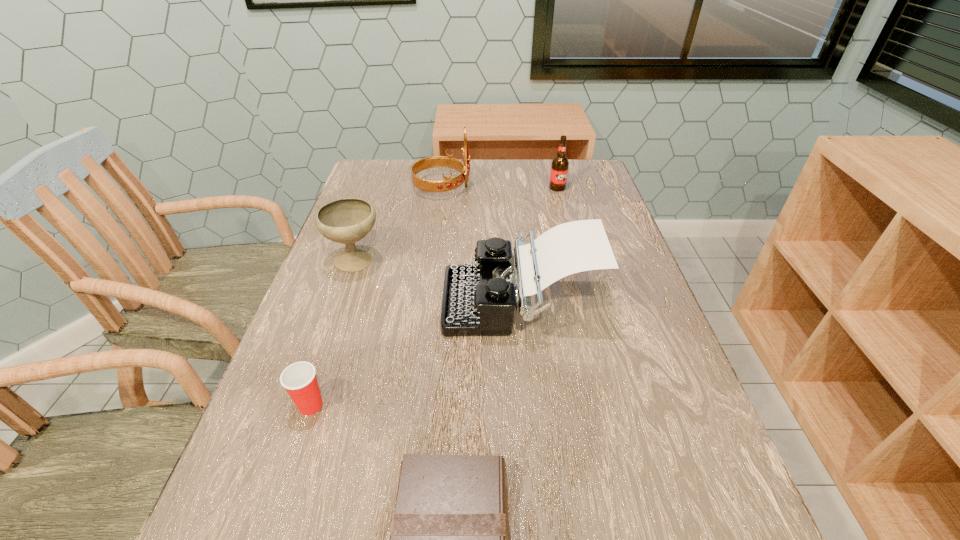
This screenshot has height=540, width=960. In the image, there is a desktop. In order to click on vacant region at the far edge in this screenshot , I will do `click(552, 197)`.

This screenshot has width=960, height=540. Find the location of `free location at the left edge`. free location at the left edge is located at coordinates (391, 222).

Locate an element on the screen. The width and height of the screenshot is (960, 540). vacant space at the right edge of the desktop is located at coordinates (649, 295).

Image resolution: width=960 pixels, height=540 pixels. I want to click on vacant space at the far left corner of the desktop, so click(405, 175).

In order to click on vacant area between the root beer and the tiara in this screenshot , I will do pos(500,187).

Find the location of `empty space that is in between the fifth farthest object and the chalice`. empty space that is in between the fifth farthest object and the chalice is located at coordinates (333, 334).

Identify the location of empty space between the second nearest object and the tiara. (376, 296).

This screenshot has width=960, height=540. I want to click on blank region between the tiara and the second nearest object, so click(376, 296).

The width and height of the screenshot is (960, 540). I want to click on free space between the tiara and the second nearest object, so 376,296.

Locate which object is the fifth closest to the Bible. Please provide its 2D coordinates. Your answer should be formatted as a tuple, i.e. [(x, y)], where the tuple contains the x and y coordinates of a point satisfying the conditions above.

[(559, 169)]